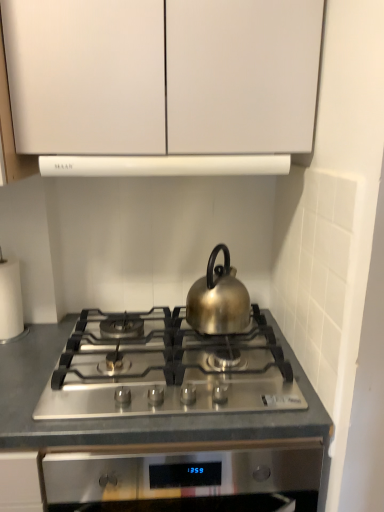
Image resolution: width=384 pixels, height=512 pixels. Describe the element at coordinates (139, 416) in the screenshot. I see `stainless steel cooktop at center` at that location.

What is the approximate height of white paper at left?

white paper at left is 10.86 inches in height.

What is the approximate height of satin silver gas stove at center?

The height of satin silver gas stove at center is 2.89 inches.

In order to face white matte cabinet at upper center, should I rotate leftwards or rightwards?

It's best to rotate left around 3.952 degrees.

What do you see at coordinates (163, 165) in the screenshot? I see `white matte exhaust hood at upper center` at bounding box center [163, 165].

Locate an element on the screen. stainless steel cooktop at center is located at coordinates (139, 416).

Which object is more forward, white matte exhaust hood at upper center or white paper at left?

white matte exhaust hood at upper center is closer to the camera.

From the image's perspective, who appears lower, white matte exhaust hood at upper center or white paper at left?

white paper at left, from the image's perspective.

Who is bigger, white matte exhaust hood at upper center or white paper at left?

Bigger between the two is white matte exhaust hood at upper center.

Is white matte exhaust hood at upper center located outside white paper at left?

white matte exhaust hood at upper center lies outside white paper at left's area.

Can you confirm if white paper at left is positioned to the left of white matte cabinet at upper center?

Correct, you'll find white paper at left to the left of white matte cabinet at upper center.

Is white paper at left aimed at white matte cabinet at upper center?

No, white paper at left is not facing towards white matte cabinet at upper center.

Is white paper at left beside white matte cabinet at upper center?

No, white paper at left is not next to white matte cabinet at upper center.

From a real-world perspective, which is physically above, white paper at left or satin silver gas stove at center?

white paper at left, from a real-world perspective.

This screenshot has height=512, width=384. Find the location of `paper towel above the satin silver gas stove at center (from a real-world perspective)`. paper towel above the satin silver gas stove at center (from a real-world perspective) is located at coordinates (10, 301).

From the image's perspective, does white paper at left appear higher than satin silver gas stove at center?

Correct, white paper at left appears higher than satin silver gas stove at center in the image.

Which is behind, white paper at left or satin silver gas stove at center?

white paper at left.

From a real-world perspective, is white paper at left physically below shiny metallic kettle at center?

Yes, from a real-world perspective, white paper at left is beneath shiny metallic kettle at center.

Considering the relative sizes of white paper at left and shiny metallic kettle at center in the image provided, is white paper at left smaller than shiny metallic kettle at center?

Indeed, white paper at left has a smaller size compared to shiny metallic kettle at center.

Which of these two, white paper at left or shiny metallic kettle at center, is thinner?

white paper at left.

Which is nearer, (9, 305) or (224, 273)?

Point (9, 305) is positioned farther from the camera compared to point (224, 273).

How distant is white matte exhaust hood at upper center from stainless steel cooktop at center?

white matte exhaust hood at upper center is 21.55 inches from stainless steel cooktop at center.

Can you confirm if white matte exhaust hood at upper center is thinner than stainless steel cooktop at center?

Yes.

This screenshot has height=512, width=384. Identify the location of counter that is on the right side of white matte exhaust hood at upper center. click(139, 416).

From the image's perspective, is white matte exhaust hood at upper center under stainless steel cooktop at center?

No.

How far apart are white matte exhaust hood at upper center and shiny metallic kettle at center?

They are 13.81 inches apart.

Which of these two, white matte exhaust hood at upper center or shiny metallic kettle at center, is bigger?

white matte exhaust hood at upper center is bigger.

Which of these two, white matte exhaust hood at upper center or shiny metallic kettle at center, stands taller?

With more height is shiny metallic kettle at center.

Are white matte exhaust hood at upper center and shiny metallic kettle at center far apart?

No, white matte exhaust hood at upper center is not far from shiny metallic kettle at center.

Is white paper at left turned away from white matte exhaust hood at upper center?

No, white paper at left is not facing the opposite direction of white matte exhaust hood at upper center.

Which is farther from the camera, (16, 287) or (133, 172)?

The point (16, 287) is farther from the camera.

Does white paper at left have a lesser height compared to white matte exhaust hood at upper center?

Incorrect, the height of white paper at left does not fall short of that of white matte exhaust hood at upper center.

Is white matte exhaust hood at upper center a part of white paper at left?

No, white paper at left does not contain white matte exhaust hood at upper center.

Locate an element on the screen. exhaust hood above the white paper at left (from the image's perspective) is located at coordinates pos(163,165).

At what (x,y) coordinates should I click in order to perform the action: click on cabinetry located above the white paper at left (from a real-world perspective). Please return your answer as a coordinate pair (x, y). The height and width of the screenshot is (512, 384). Looking at the image, I should click on (86, 75).

From the image, which object appears to be farther from satin silver gas stove at center, white matte cabinet at upper center or white matte exhaust hood at upper center?

white matte cabinet at upper center.

Based on their spatial positions, is white matte cabinet at upper center or white matte exhaust hood at upper center closer to white paper at left?

The object closer to white paper at left is white matte exhaust hood at upper center.

Which object lies nearer to the anchor point white paper at left, stainless steel cooktop at center or shiny metallic kettle at center?

Based on the image, stainless steel cooktop at center appears to be nearer to white paper at left.

Based on their spatial positions, is satin silver gas stove at center or white matte cabinet at upper center closer to white paper at left?

satin silver gas stove at center is closer to white paper at left.

Based on their spatial positions, is satin silver gas stove at center or white matte exhaust hood at upper center closer to white paper at left?

Among the two, satin silver gas stove at center is located nearer to white paper at left.

Estimate the real-world distances between objects in this image. Which object is further from white matte exhaust hood at upper center, satin silver gas stove at center or white matte cabinet at upper center?

satin silver gas stove at center is further to white matte exhaust hood at upper center.

When comparing their distances from white matte exhaust hood at upper center, does stainless steel cooktop at center or white paper at left seem further?

Among the two, stainless steel cooktop at center is located further to white matte exhaust hood at upper center.

Based on the photo, considering their positions, is shiny metallic kettle at center positioned further to satin silver gas stove at center than white matte cabinet at upper center?

Among the two, white matte cabinet at upper center is located further to satin silver gas stove at center.

The height and width of the screenshot is (512, 384). I want to click on gas stove between white paper at left and shiny metallic kettle at center, so click(x=167, y=369).

I want to click on exhaust hood between white matte cabinet at upper center and white paper at left vertically, so click(x=163, y=165).

You are a GUI agent. You are given a task and a screenshot of the screen. Output one action in this format:
    pyautogui.click(x=<x>, y=<y>)
    Task: Click on the gas stove between white matte exhaust hood at upper center and stainless steel cooktop at center from top to bottom
    Image resolution: width=384 pixels, height=512 pixels.
    Given the screenshot: What is the action you would take?
    pyautogui.click(x=167, y=369)

Find the location of a particular element. paper towel between white matte cabinet at upper center and stainless steel cooktop at center in the vertical direction is located at coordinates (10, 301).